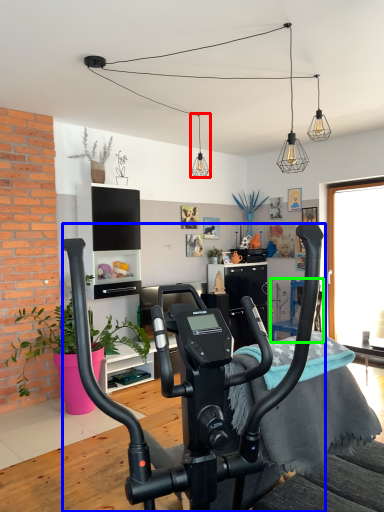
Question: Estimate the real-world distances between objects in this image. Which object is closer to light fixture (highlighted by a red box), stationary bicycle (highlighted by a blue box) or armchair (highlighted by a green box)?

Choices:
 (A) stationary bicycle
 (B) armchair

Answer: (B)